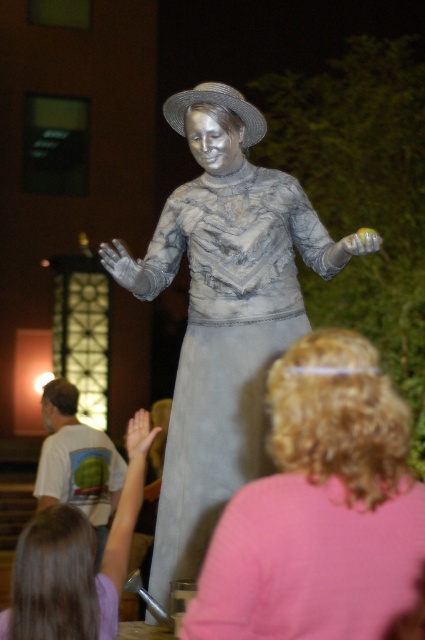
Question: Does blonde curly hair at center have a lesser width compared to matte gray statue at center?

Choices:
 (A) no
 (B) yes

Answer: (B)

Question: Which point is farther from the camera taking this photo?

Choices:
 (A) (64, 605)
 (B) (51, 428)
 (C) (334, 540)
 (D) (303, 230)

Answer: (B)

Question: Does blonde curly hair at center appear on the left side of matte gray statue at center?

Choices:
 (A) yes
 (B) no

Answer: (B)

Question: Which object appears farthest from the camera in this image?

Choices:
 (A) silver/statue at center
 (B) matte silver statue at center
 (C) matte gray statue at center
 (D) blonde curly hair at center

Answer: (C)

Question: Which object appears closest to the camera in this image?

Choices:
 (A) silver/statue at center
 (B) matte gray statue at center
 (C) matte silver statue at center
 (D) blonde curly hair at center

Answer: (D)

Question: Does matte silver statue at center come behind matte gray statue at center?

Choices:
 (A) no
 (B) yes

Answer: (A)